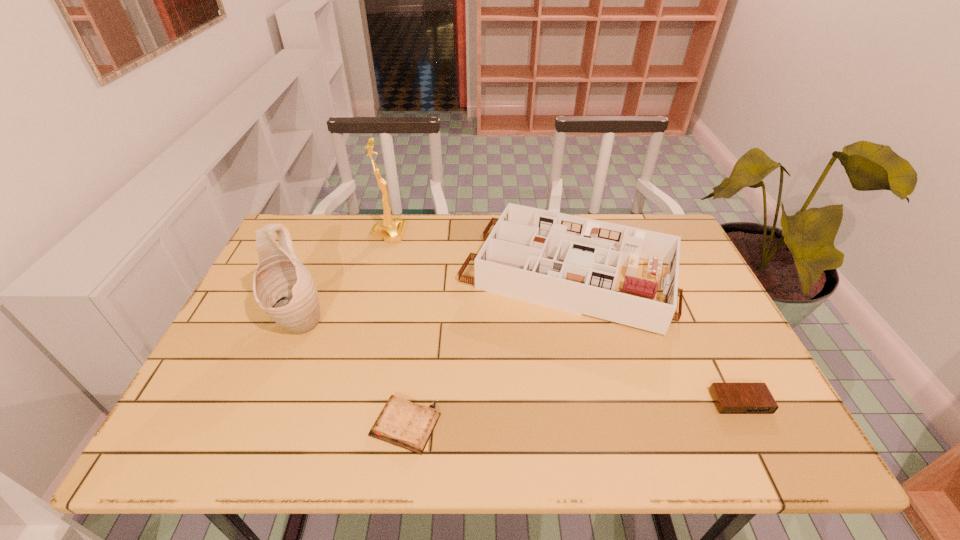
Find the location of `vacant region that satisfies the following two spatial constraints: 1. on the front-facing side of the fourth object from right to left; 2. on the right side of the third shortest object`. vacant region that satisfies the following two spatial constraints: 1. on the front-facing side of the fourth object from right to left; 2. on the right side of the third shortest object is located at coordinates (378, 274).